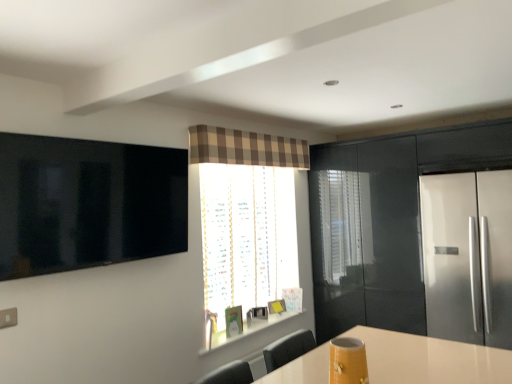
Question: From the image's perspective, would you say glossy black cabinet at right is positioned over satin silver fridge at right?

Choices:
 (A) no
 (B) yes

Answer: (B)

Question: Is there a large distance between glossy black cabinet at right and satin silver fridge at right?

Choices:
 (A) no
 (B) yes

Answer: (A)

Question: Can you confirm if glossy black cabinet at right is taller than satin silver fridge at right?

Choices:
 (A) yes
 (B) no

Answer: (A)

Question: From a real-world perspective, is glossy black cabinet at right located beneath satin silver fridge at right?

Choices:
 (A) no
 (B) yes

Answer: (A)

Question: Is glossy black cabinet at right completely or partially outside of satin silver fridge at right?

Choices:
 (A) no
 (B) yes

Answer: (B)

Question: Is satin silver fridge at right completely or partially inside glossy black cabinet at right?

Choices:
 (A) yes
 (B) no

Answer: (A)

Question: Does satin silver fridge at right come in front of brown plaid curtain at upper center?

Choices:
 (A) yes
 (B) no

Answer: (A)

Question: Would you say satin silver fridge at right is a long distance from brown plaid curtain at upper center?

Choices:
 (A) yes
 (B) no

Answer: (A)

Question: Does satin silver fridge at right have a lesser width compared to brown plaid curtain at upper center?

Choices:
 (A) no
 (B) yes

Answer: (A)

Question: Does satin silver fridge at right have a greater width compared to brown plaid curtain at upper center?

Choices:
 (A) yes
 (B) no

Answer: (A)

Question: Considering the relative positions of satin silver fridge at right and brown plaid curtain at upper center in the image provided, is satin silver fridge at right to the right of brown plaid curtain at upper center from the viewer's perspective?

Choices:
 (A) yes
 (B) no

Answer: (A)

Question: From the image's perspective, is satin silver fridge at right located beneath brown plaid curtain at upper center?

Choices:
 (A) yes
 (B) no

Answer: (A)

Question: Is glossy black cabinet at right smaller than brown plaid curtain at upper center?

Choices:
 (A) no
 (B) yes

Answer: (A)